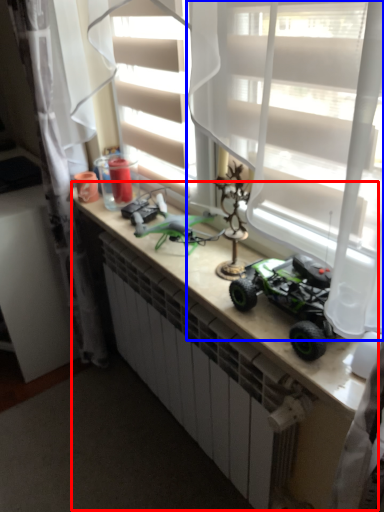
Question: Among these objects, which one is farthest to the camera, counter (highlighted by a red box) or curtain (highlighted by a blue box)?

Choices:
 (A) counter
 (B) curtain

Answer: (A)